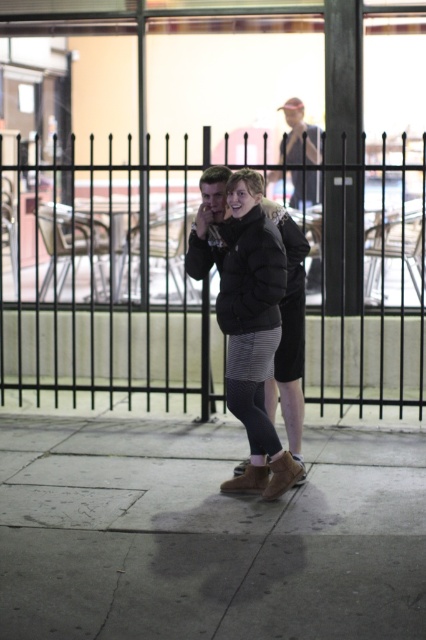
You are a fashion designer observing two jackets in an urban setting. The black puffer jacket at center and the light brown leather jacket at upper center. Which jacket is located lower in the image?

The black puffer jacket at center is positioned under the light brown leather jacket at upper center, so it is located lower in the image.

You are a photographer trying to capture a candid shot of the two people in the scene. You want to ensure the brown leather boots at center and the black puffer jacket at center are both in focus. Since you can only focus on one subject at a time, which object should you prioritize focusing on to ensure both are sharp?

You should focus on the black puffer jacket at center because the brown leather boots at center are to the right of it. By focusing on the closer object, you can ensure both are in focus due to the depth of field extending beyond the focal point.